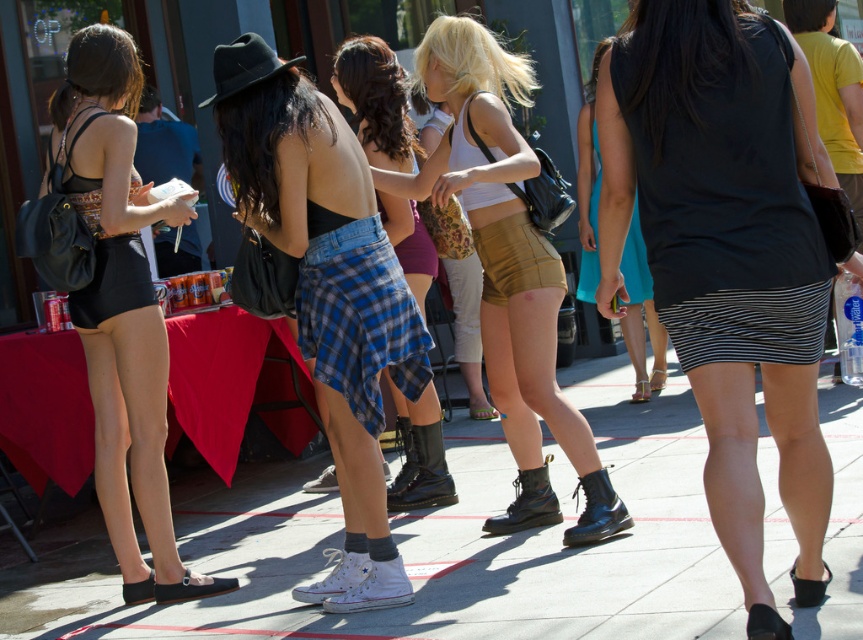
Can you confirm if black matte shorts at left is smaller than plaid skirt at center?

No.

Is black matte shorts at left to the left of plaid skirt at center from the viewer's perspective?

Yes, black matte shorts at left is to the left of plaid skirt at center.

Is point (146, 209) positioned behind point (389, 76)?

No.

At what (x,y) coordinates should I click in order to perform the action: click on black matte shorts at left. Please return your answer as a coordinate pair (x, y). Looking at the image, I should click on (123, 310).

Is white concrete pavement at center thinner than black matte skirt at center?

Yes, white concrete pavement at center is thinner than black matte skirt at center.

Looking at this image, does white concrete pavement at center have a smaller size compared to black matte skirt at center?

Yes, white concrete pavement at center is smaller than black matte skirt at center.

Between point (641, 611) and point (709, 49), which one is positioned in front?

Positioned in front is point (709, 49).

Find the location of a particular element. white concrete pavement at center is located at coordinates pyautogui.click(x=427, y=547).

What do you see at coordinates (427, 547) in the screenshot? I see `white concrete pavement at center` at bounding box center [427, 547].

What are the coordinates of `white concrete pavement at center` in the screenshot? It's located at (427, 547).